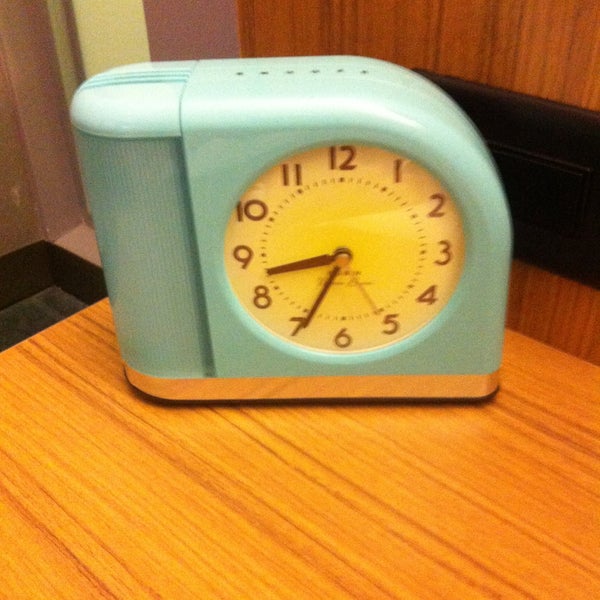
Where is `table`? Image resolution: width=600 pixels, height=600 pixels. table is located at coordinates (120, 451).